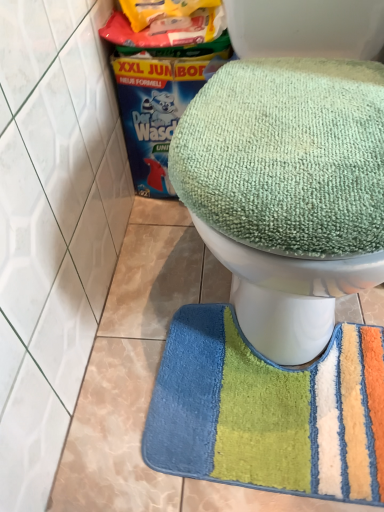
Question: Is multicolored plush bath mat at lower center shorter than green fabric toilet at upper center?

Choices:
 (A) no
 (B) yes

Answer: (B)

Question: Can you confirm if multicolored plush bath mat at lower center is positioned to the right of green fabric toilet at upper center?

Choices:
 (A) yes
 (B) no

Answer: (B)

Question: From a real-world perspective, is multicolored plush bath mat at lower center located beneath green fabric toilet at upper center?

Choices:
 (A) yes
 (B) no

Answer: (A)

Question: Does multicolored plush bath mat at lower center have a smaller size compared to green fabric toilet at upper center?

Choices:
 (A) yes
 (B) no

Answer: (A)

Question: Could you tell me if multicolored plush bath mat at lower center is facing green fabric toilet at upper center?

Choices:
 (A) no
 (B) yes

Answer: (A)

Question: Is multicolored plush bath mat at lower center positioned with its back to green fabric toilet at upper center?

Choices:
 (A) yes
 (B) no

Answer: (B)

Question: Is green fabric toilet at upper center next to multicolored plush bath mat at lower center?

Choices:
 (A) yes
 (B) no

Answer: (B)

Question: From a real-world perspective, does green fabric toilet at upper center stand above multicolored plush bath mat at lower center?

Choices:
 (A) no
 (B) yes

Answer: (B)

Question: Is multicolored plush bath mat at lower center located within green fabric toilet at upper center?

Choices:
 (A) no
 (B) yes

Answer: (A)

Question: Could you tell me if green fabric toilet at upper center is turned towards multicolored plush bath mat at lower center?

Choices:
 (A) yes
 (B) no

Answer: (B)

Question: From the image's perspective, is green fabric toilet at upper center located above multicolored plush bath mat at lower center?

Choices:
 (A) no
 (B) yes

Answer: (B)

Question: Can you confirm if green fabric toilet at upper center is bigger than multicolored plush bath mat at lower center?

Choices:
 (A) yes
 (B) no

Answer: (A)

Question: Is green fabric toilet at upper center taller or shorter than multicolored plush bath mat at lower center?

Choices:
 (A) tall
 (B) short

Answer: (A)